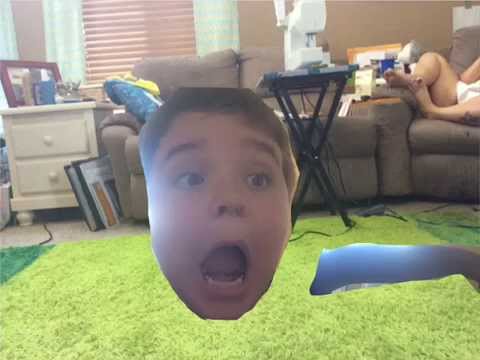
Find the location of a particular element. The image size is (480, 360). blinds is located at coordinates (105, 56).